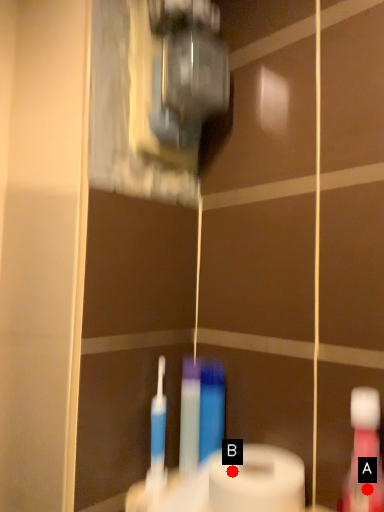
Question: Two points are circled on the image, labeled by A and B beside each circle. Which point appears farthest from the camera in this image?

Choices:
 (A) A is further
 (B) B is further

Answer: (B)